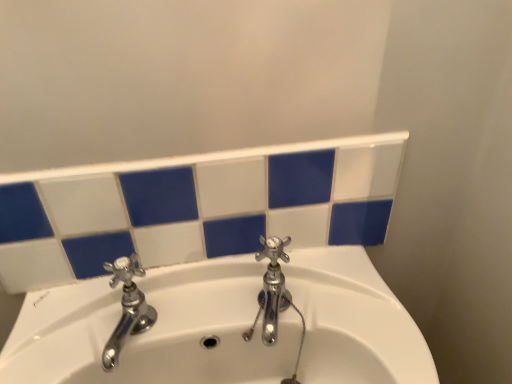
Locate an element on the screen. The height and width of the screenshot is (384, 512). chrome metallic faucet at center, the second tap viewed from the left is located at coordinates (271, 289).

The width and height of the screenshot is (512, 384). What do you see at coordinates (271, 289) in the screenshot?
I see `chrome metallic faucet at center, which is counted as the 1th tap, starting from the right` at bounding box center [271, 289].

The image size is (512, 384). I want to click on polished chrome faucet at left, which is the 2th tap from right to left, so click(127, 308).

Image resolution: width=512 pixels, height=384 pixels. What do you see at coordinates (127, 308) in the screenshot? I see `polished chrome faucet at left, which is the 2th tap from right to left` at bounding box center [127, 308].

At what (x,y) coordinates should I click in order to perform the action: click on chrome metallic faucet at center, which is counted as the 1th tap, starting from the right. Please return your answer as a coordinate pair (x, y). This screenshot has height=384, width=512. Looking at the image, I should click on (271, 289).

Based on their positions, is polished chrome faucet at left, which is the 1th tap in left-to-right order, located to the left or right of chrome metallic faucet at center, the second tap viewed from the left?

polished chrome faucet at left, which is the 1th tap in left-to-right order, is positioned on chrome metallic faucet at center, the second tap viewed from the left,'s left side.

Is polished chrome faucet at left, which is the 2th tap from right to left, in front of or behind chrome metallic faucet at center, the second tap viewed from the left, in the image?

Visually, polished chrome faucet at left, which is the 2th tap from right to left, is located in front of chrome metallic faucet at center, the second tap viewed from the left.

Does point (110, 356) appear closer or farther from the camera than point (273, 300)?

Clearly, point (110, 356) is closer to the camera than point (273, 300).

From the image's perspective, is polished chrome faucet at left, which is the 1th tap in left-to-right order, below chrome metallic faucet at center, the second tap viewed from the left?

Yes.

From a real-world perspective, which object rests below the other?

chrome metallic faucet at center, which is counted as the 1th tap, starting from the right, from a real-world perspective.

Which of these two, polished chrome faucet at left, which is the 2th tap from right to left, or chrome metallic faucet at center, which is counted as the 1th tap, starting from the right, is thinner?

polished chrome faucet at left, which is the 2th tap from right to left.

Looking at this image, considering the sizes of objects polished chrome faucet at left, which is the 1th tap in left-to-right order, and chrome metallic faucet at center, which is counted as the 1th tap, starting from the right, in the image provided, who is taller, polished chrome faucet at left, which is the 1th tap in left-to-right order, or chrome metallic faucet at center, which is counted as the 1th tap, starting from the right,?

Standing taller between the two is chrome metallic faucet at center, which is counted as the 1th tap, starting from the right.

Is polished chrome faucet at left, which is the 1th tap in left-to-right order, bigger or smaller than chrome metallic faucet at center, the second tap viewed from the left?

In the image, polished chrome faucet at left, which is the 1th tap in left-to-right order, appears to be smaller than chrome metallic faucet at center, the second tap viewed from the left.

Is polished chrome faucet at left, which is the 2th tap from right to left, located outside chrome metallic faucet at center, the second tap viewed from the left?

Absolutely, polished chrome faucet at left, which is the 2th tap from right to left, is external to chrome metallic faucet at center, the second tap viewed from the left.

Is polished chrome faucet at left, which is the 2th tap from right to left, not close to chrome metallic faucet at center, the second tap viewed from the left?

They are positioned close to each other.

Is polished chrome faucet at left, which is the 2th tap from right to left, oriented away from chrome metallic faucet at center, the second tap viewed from the left?

No, chrome metallic faucet at center, the second tap viewed from the left, is not at the back of polished chrome faucet at left, which is the 2th tap from right to left.

How many degrees apart are the facing directions of polished chrome faucet at left, which is the 2th tap from right to left, and chrome metallic faucet at center, which is counted as the 1th tap, starting from the right?

The angular difference between polished chrome faucet at left, which is the 2th tap from right to left, and chrome metallic faucet at center, which is counted as the 1th tap, starting from the right, is 13.6 degrees.

Could you measure the distance between polished chrome faucet at left, which is the 2th tap from right to left, and chrome metallic faucet at center, which is counted as the 1th tap, starting from the right?

7.17 inches.

At what (x,y) coordinates should I click in order to perform the action: click on tap positioned vertically above the chrome metallic faucet at center, the second tap viewed from the left (from a real-world perspective). Please return your answer as a coordinate pair (x, y). Looking at the image, I should click on (127, 308).

Considering the positions of objects chrome metallic faucet at center, which is counted as the 1th tap, starting from the right, and polished chrome faucet at left, which is the 2th tap from right to left, in the image provided, who is more to the right, chrome metallic faucet at center, which is counted as the 1th tap, starting from the right, or polished chrome faucet at left, which is the 2th tap from right to left,?

From the viewer's perspective, chrome metallic faucet at center, which is counted as the 1th tap, starting from the right, appears more on the right side.

Considering the positions of objects chrome metallic faucet at center, which is counted as the 1th tap, starting from the right, and polished chrome faucet at left, which is the 1th tap in left-to-right order, in the image provided, who is in front, chrome metallic faucet at center, which is counted as the 1th tap, starting from the right, or polished chrome faucet at left, which is the 1th tap in left-to-right order,?

polished chrome faucet at left, which is the 1th tap in left-to-right order.

Considering the points (263, 287) and (112, 264), which point is in front, point (263, 287) or point (112, 264)?

Point (112, 264)

From the image's perspective, is chrome metallic faucet at center, the second tap viewed from the left, located above polished chrome faucet at left, which is the 2th tap from right to left?

Indeed, from the image's perspective, chrome metallic faucet at center, the second tap viewed from the left, is shown above polished chrome faucet at left, which is the 2th tap from right to left.

From a real-world perspective, between chrome metallic faucet at center, the second tap viewed from the left, and polished chrome faucet at left, which is the 1th tap in left-to-right order, who is vertically lower?

chrome metallic faucet at center, the second tap viewed from the left.

Which object is thinner, chrome metallic faucet at center, the second tap viewed from the left, or polished chrome faucet at left, which is the 1th tap in left-to-right order?

polished chrome faucet at left, which is the 1th tap in left-to-right order, is thinner.

Does chrome metallic faucet at center, the second tap viewed from the left, have a greater height compared to polished chrome faucet at left, which is the 2th tap from right to left?

Indeed, chrome metallic faucet at center, the second tap viewed from the left, has a greater height compared to polished chrome faucet at left, which is the 2th tap from right to left.

Is chrome metallic faucet at center, the second tap viewed from the left, bigger than polished chrome faucet at left, which is the 2th tap from right to left?

Yes, chrome metallic faucet at center, the second tap viewed from the left, is bigger than polished chrome faucet at left, which is the 2th tap from right to left.

Is polished chrome faucet at left, which is the 1th tap in left-to-right order, located within chrome metallic faucet at center, the second tap viewed from the left?

That's incorrect, polished chrome faucet at left, which is the 1th tap in left-to-right order, is not inside chrome metallic faucet at center, the second tap viewed from the left.

Is chrome metallic faucet at center, the second tap viewed from the left, in contact with polished chrome faucet at left, which is the 1th tap in left-to-right order?

No, chrome metallic faucet at center, the second tap viewed from the left, is not making contact with polished chrome faucet at left, which is the 1th tap in left-to-right order.

Is chrome metallic faucet at center, which is counted as the 1th tap, starting from the right, looking in the opposite direction of polished chrome faucet at left, which is the 2th tap from right to left?

chrome metallic faucet at center, which is counted as the 1th tap, starting from the right, does not have its back to polished chrome faucet at left, which is the 2th tap from right to left.

What's the angular difference between chrome metallic faucet at center, which is counted as the 1th tap, starting from the right, and polished chrome faucet at left, which is the 1th tap in left-to-right order,'s facing directions?

There is a 13.6-degree angle between the facing directions of chrome metallic faucet at center, which is counted as the 1th tap, starting from the right, and polished chrome faucet at left, which is the 1th tap in left-to-right order.

I want to click on tap that appears on the left of chrome metallic faucet at center, the second tap viewed from the left, so click(x=127, y=308).

The width and height of the screenshot is (512, 384). What are the coordinates of `tap in front of the chrome metallic faucet at center, which is counted as the 1th tap, starting from the right` in the screenshot? It's located at click(x=127, y=308).

Where is `tap on the left of chrome metallic faucet at center, the second tap viewed from the left`? This screenshot has width=512, height=384. tap on the left of chrome metallic faucet at center, the second tap viewed from the left is located at coordinates (127, 308).